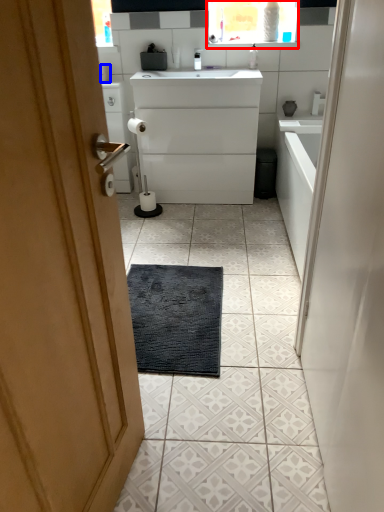
Question: Which of the following is the farthest to the observer, medicine cabinet (highlighted by a red box) or toilet paper (highlighted by a blue box)?

Choices:
 (A) medicine cabinet
 (B) toilet paper

Answer: (B)